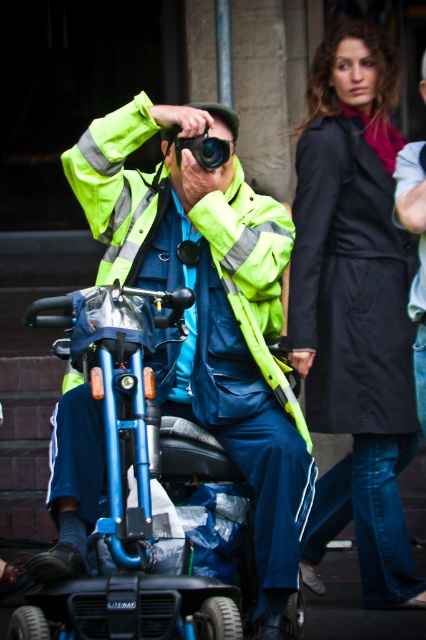
Between point (241, 301) and point (359, 458), which one is positioned in front?

Positioned in front is point (241, 301).

Does neon yellow reflective jacket at center have a greater width compared to black matte coat at upper right?

Indeed, neon yellow reflective jacket at center has a greater width compared to black matte coat at upper right.

Is point (81, 186) behind point (302, 376)?

No.

I want to click on neon yellow reflective jacket at center, so click(x=210, y=310).